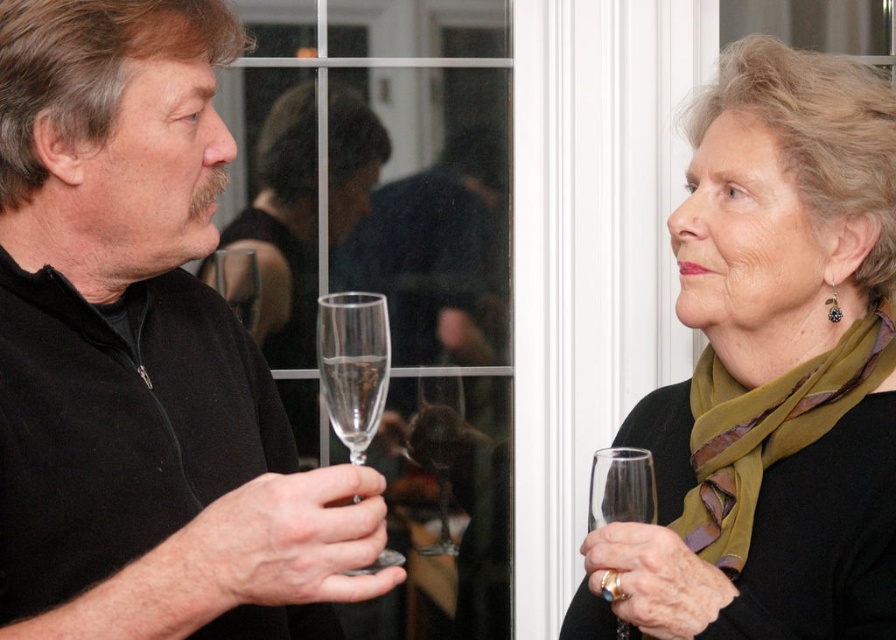
Question: Among these objects, which one is farthest from the camera?

Choices:
 (A) matte black wine glass at left
 (B) clear glass wine glass at right
 (C) matte green scarf at right

Answer: (B)

Question: Which point is farther to the camera?

Choices:
 (A) clear glass wine glass at right
 (B) clear glass flute at center
 (C) matte black wine glass at left
 (D) green silk scarf at right

Answer: (D)

Question: Which point is farther to the camera?

Choices:
 (A) (415, 444)
 (B) (756, 586)
 (C) (631, 509)

Answer: (A)

Question: Can you confirm if matte green scarf at right is wider than clear glass flute at left?

Choices:
 (A) yes
 (B) no

Answer: (A)

Question: Does green silk scarf at right appear on the left side of clear glass flute at center?

Choices:
 (A) no
 (B) yes

Answer: (A)

Question: Can you confirm if matte green scarf at right is positioned below clear glass flute at left?

Choices:
 (A) no
 (B) yes

Answer: (A)